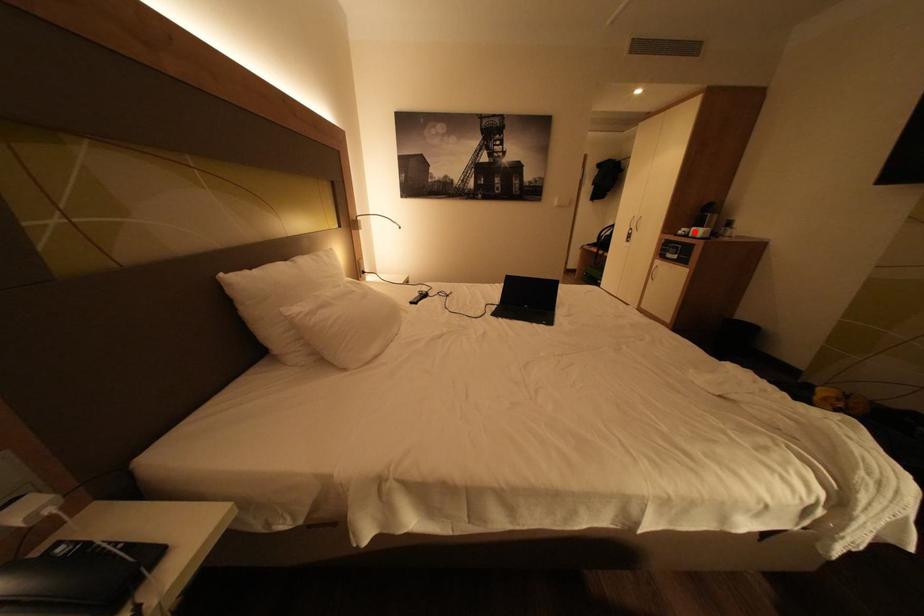
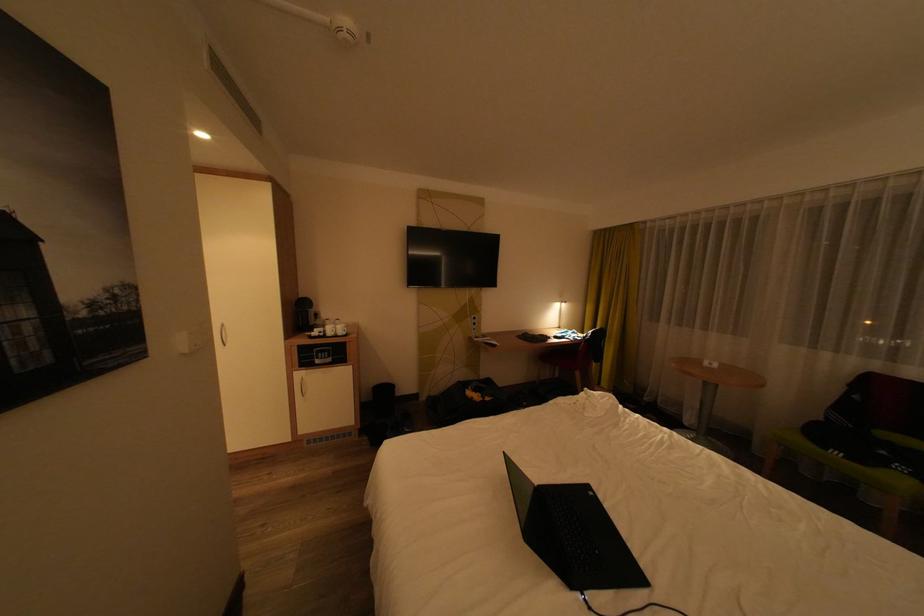
Where in the second image is the point corresponding to the highlighted location from the first image?

(331, 333)